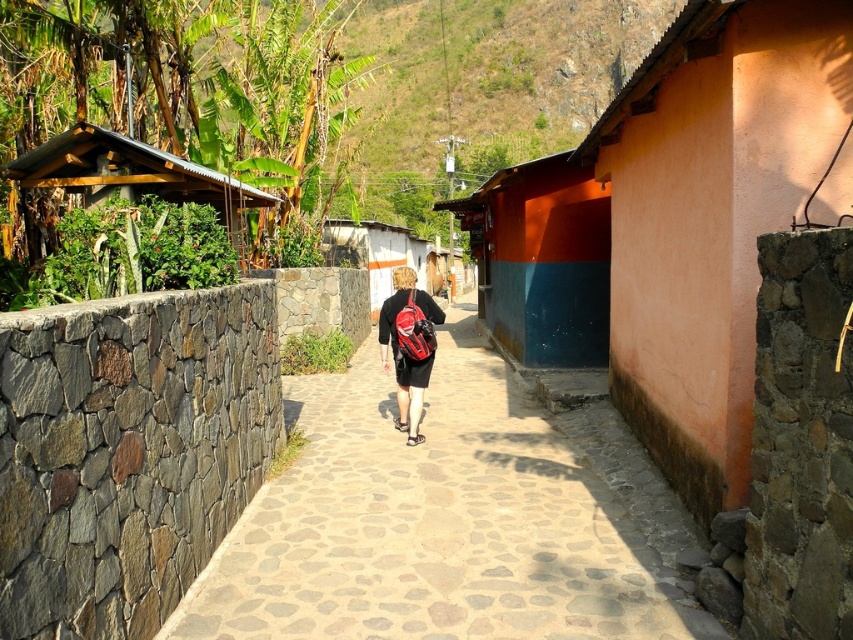
You are a tourist walking on the cobblestone path and you see a matte red backpack at center and a white stucco hut at center. Which object is closer to you?

The matte red backpack at center is closer to you because it is located below the white stucco hut at center, indicating it is in a lower position relative to the viewer.